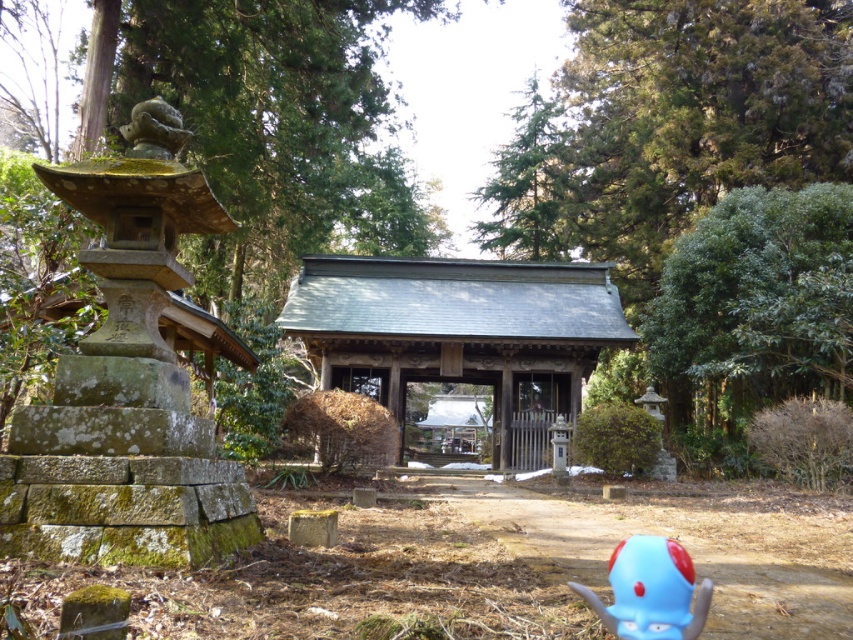
You are a visitor at the shrine and want to take a photo that includes both the mossy stone lantern at left and the green leafy tree at right. The camera you have can capture a maximum distance of 12 meters between the closest and farthest objects in focus. Will you be able to capture both objects in focus with this camera?

The mossy stone lantern at left is 15.09 meters away from the green leafy tree at right. Since the camera can only focus up to 12 meters, the distance between them exceeds the camera limit. Therefore, you cannot capture both in focus with this camera.

You are standing at the entrance of the traditional wooden building and want to plant a new tree exactly where the green leafy tree at right is currently located. Can you confirm the exact coordinates where you should plant the new tree?

The green leafy tree at right should be planted at coordinates point (752, 314) as specified in the description.